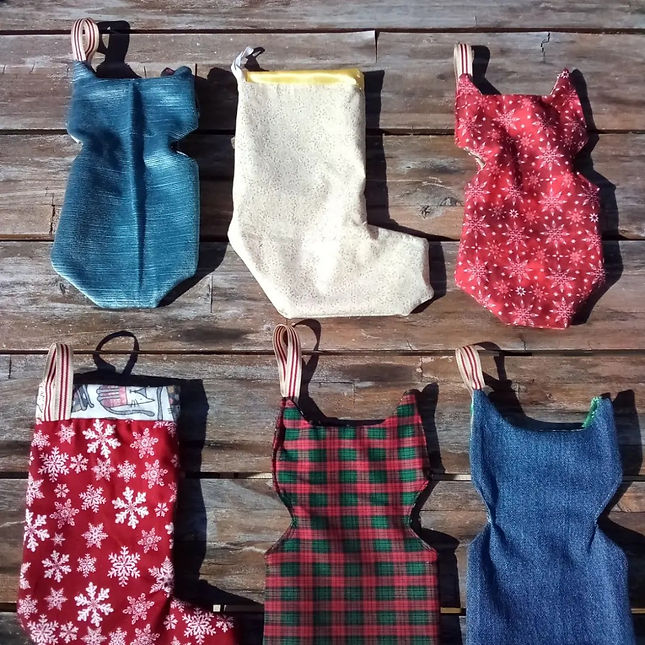
Locate an element on the screen. red stocking is located at coordinates (100, 481), (470, 279), (358, 522).